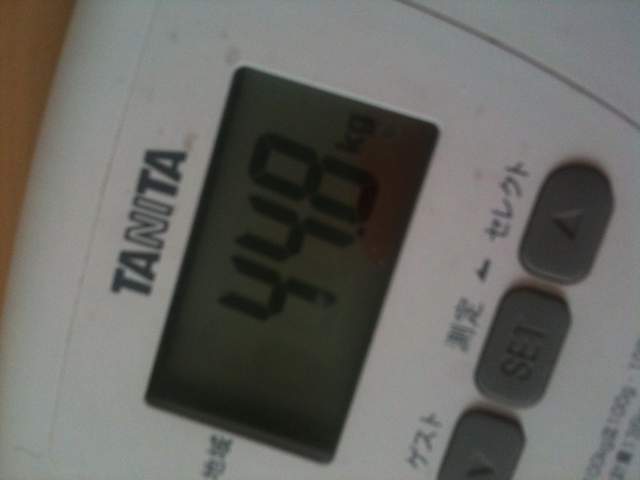
You are a GUI agent. You are given a task and a screenshot of the screen. Output one action in this format:
    pyautogui.click(x=<x>, y=<y>)
    Task: Click on the text - engraved into rubber button = set
    The image size is (640, 480).
    Given the screenshot: What is the action you would take?
    pyautogui.click(x=518, y=351)